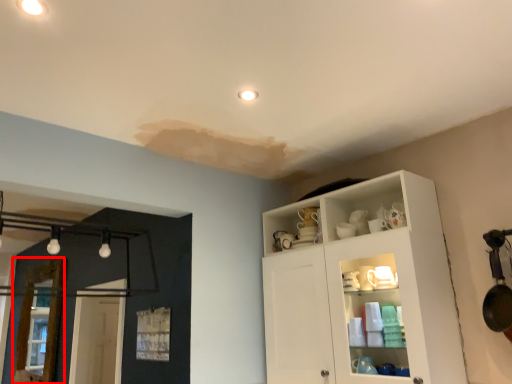
Question: Observing the image, what is the correct spatial positioning of screen door (annotated by the red box) in reference to cupboard?

Choices:
 (A) right
 (B) left

Answer: (B)